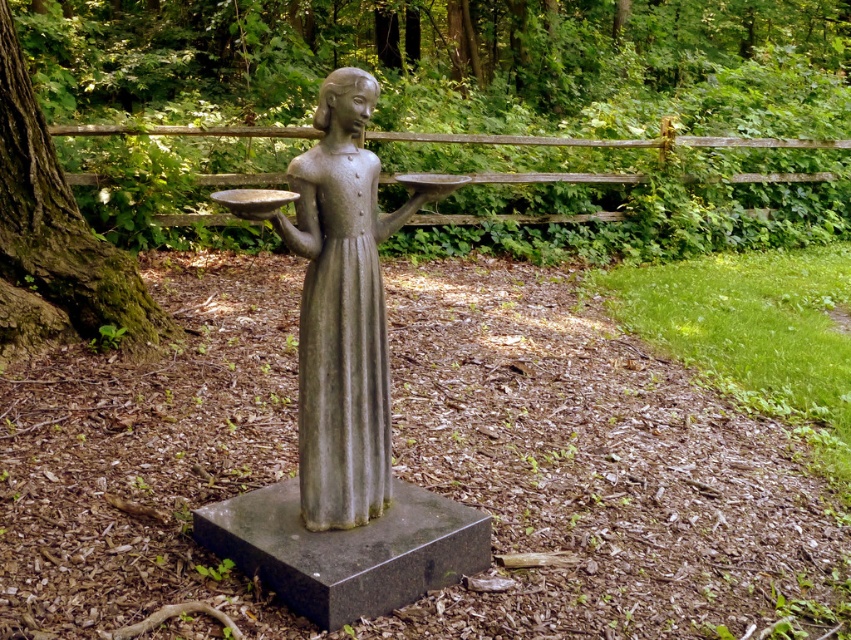
Based on the photo, you are a gardener who needs to place a new decorative pot that is 1 meter tall. You see the bronze statue at center and the green mossy tree trunk at left. Which object can the pot be placed next to without blocking the view of the smaller one?

The bronze statue at center is smaller than the green mossy tree trunk at left. Therefore, the decorative pot should be placed next to the green mossy tree trunk at left to avoid blocking the view of the smaller bronze statue at center.

You are a photographer wanting to capture the bronze statue at center and the green mossy tree trunk at left in the same frame. Based on their positions, which object will appear larger in the photo?

The bronze statue at center will appear larger in the photo because it is closer to the viewer than the green mossy tree trunk at left.